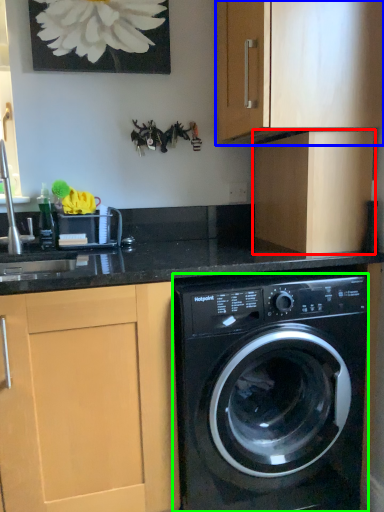
Question: Which is nearer to the cabinetry (highlighted by a red box)? cabinetry (highlighted by a blue box) or washing machine (highlighted by a green box).

Choices:
 (A) cabinetry
 (B) washing machine

Answer: (A)